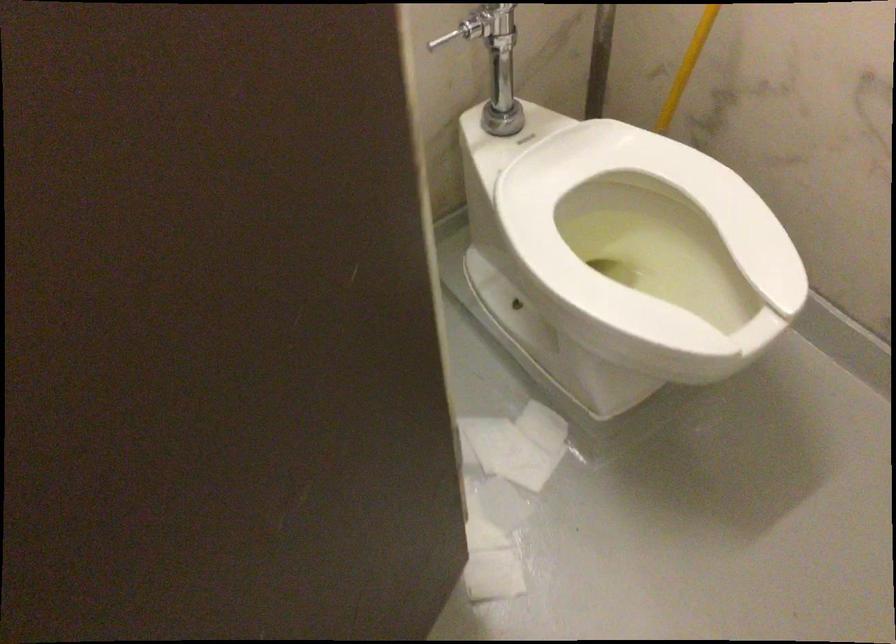
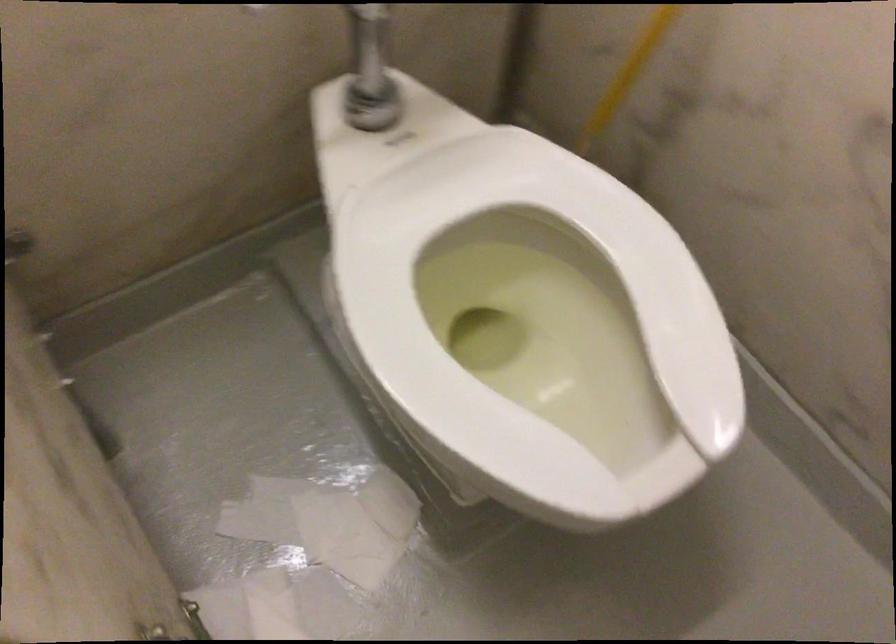
Which direction would the cameraman need to move to produce the second image?

The cameraman walked toward right, forward.